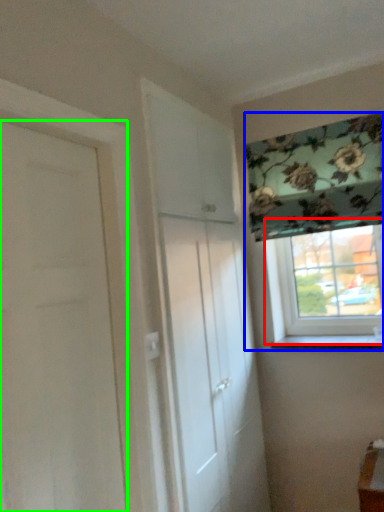
Question: Considering the real-world distances, which object is farthest from window (highlighted by a red box)? window (highlighted by a blue box) or door (highlighted by a green box)?

Choices:
 (A) window
 (B) door

Answer: (B)